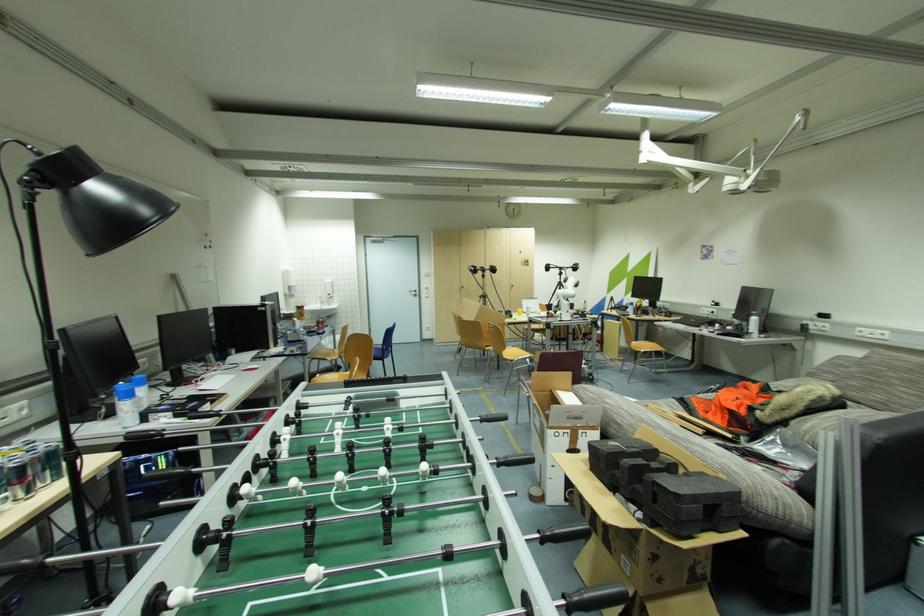
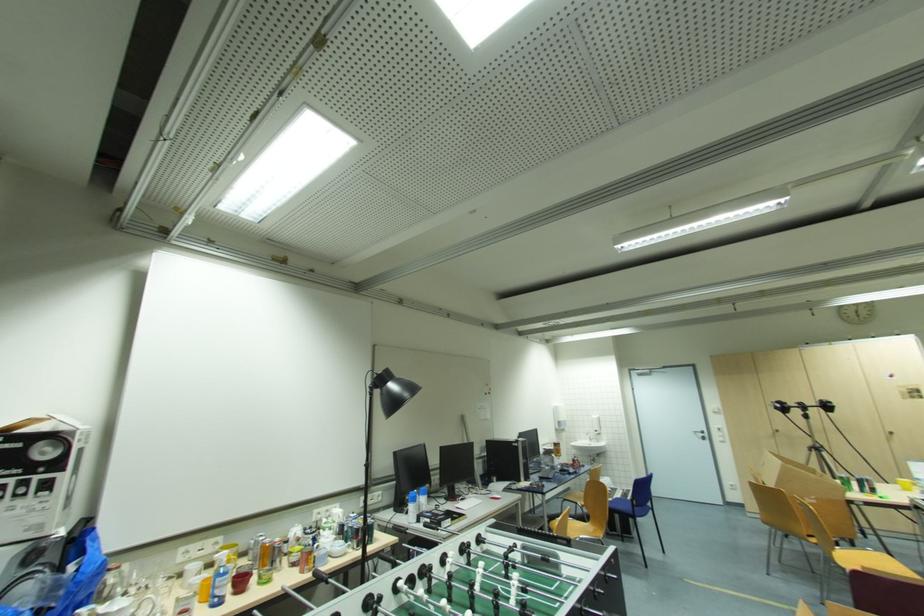
The point at (148, 421) is marked in the first image. Where is the corresponding point in the second image?

(420, 522)